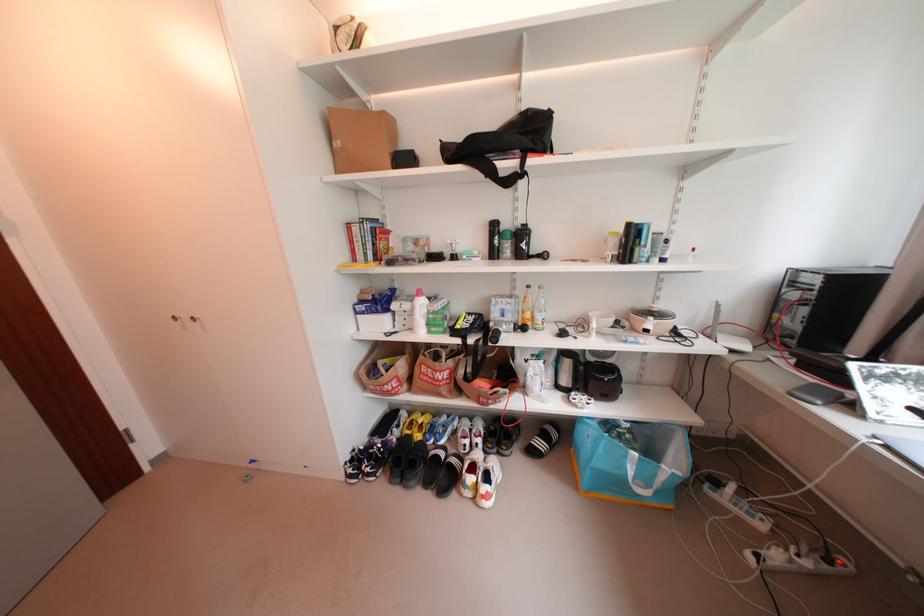
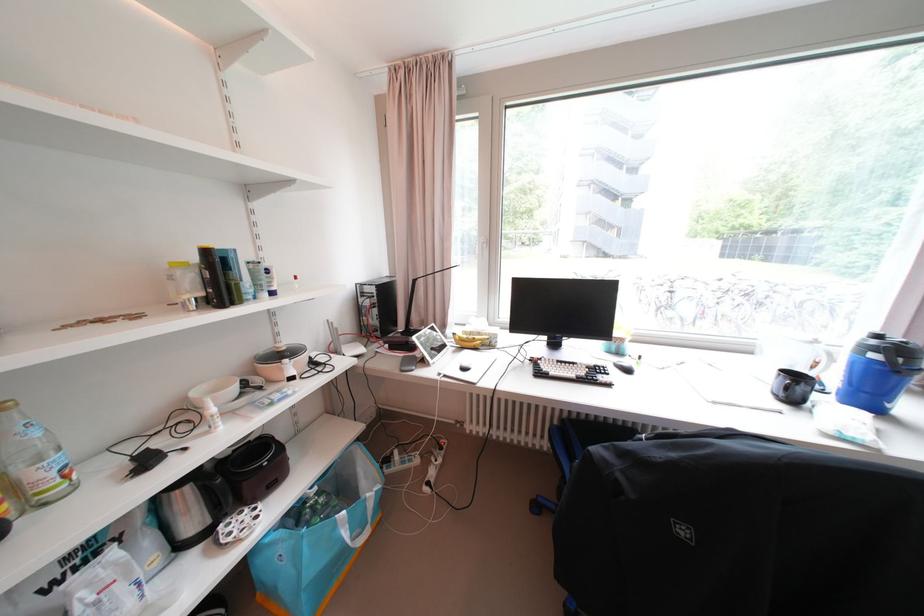
Find the pixel in the second image that matches [548,289] in the first image.

(6, 410)